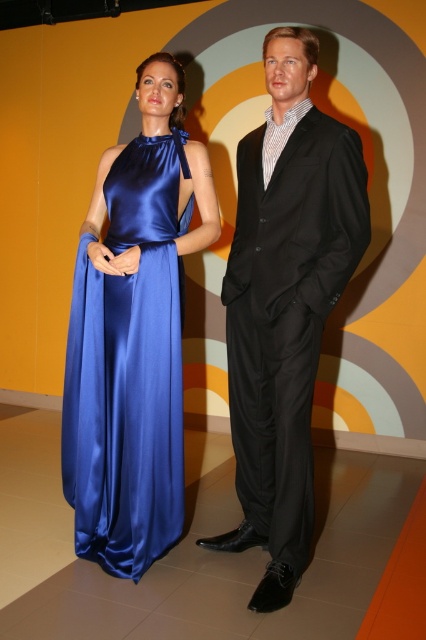
Question: Which point appears closest to the camera in this image?

Choices:
 (A) (146, 404)
 (B) (262, 154)

Answer: (B)

Question: Is black satin suit at center below satin blue dress at left?

Choices:
 (A) yes
 (B) no

Answer: (B)

Question: Can you confirm if black satin suit at center is thinner than satin blue dress at left?

Choices:
 (A) yes
 (B) no

Answer: (B)

Question: Which point is closer to the camera?

Choices:
 (A) (134, 456)
 (B) (294, 93)

Answer: (B)

Question: Can you confirm if black satin suit at center is positioned to the right of satin blue dress at left?

Choices:
 (A) yes
 (B) no

Answer: (A)